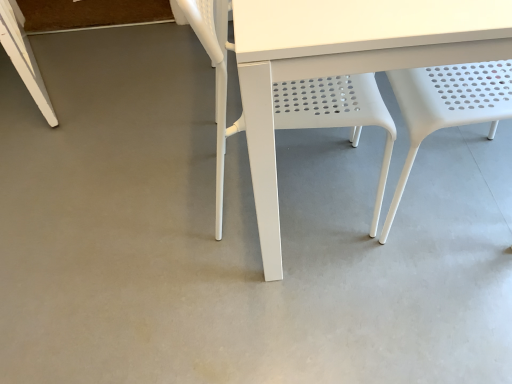
Find the location of a particular element. The image size is (512, 384). unoccupied area in front of white plastic chair at center, which appears as the 2th chair when viewed from the right is located at coordinates (311, 306).